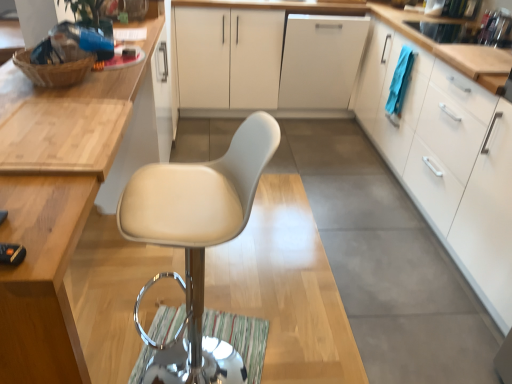
Question: In terms of width, does white leather chair at center look wider or thinner when compared to white matte cabinet at right, which is the third cabinetry in left-to-right order?

Choices:
 (A) wide
 (B) thin

Answer: (B)

Question: Is white leather chair at center to the left or to the right of white matte cabinet at right, acting as the 1th cabinetry starting from the right, in the image?

Choices:
 (A) right
 (B) left

Answer: (B)

Question: Estimate the real-world distances between objects in this image. Which object is closer to the white matte cabinet at center, positioned as the 2th cabinetry in left-to-right order?

Choices:
 (A) white leather chair at center
 (B) white glossy countertop at center
 (C) white matte cabinet at center
 (D) white matte cabinet at right, which is the third cabinetry in left-to-right order
 (E) matte wood cabinet at upper left, positioned as the 3th cabinetry in right-to-left order

Answer: (C)

Question: Estimate the real-world distances between objects in this image. Which object is farther from the white matte cabinet at center?

Choices:
 (A) white matte cabinet at right, acting as the 1th cabinetry starting from the right
 (B) white matte cabinet at center, acting as the second cabinetry starting from the right
 (C) white leather chair at center
 (D) matte wood cabinet at upper left, the first cabinetry from the left
 (E) white glossy countertop at center

Answer: (C)